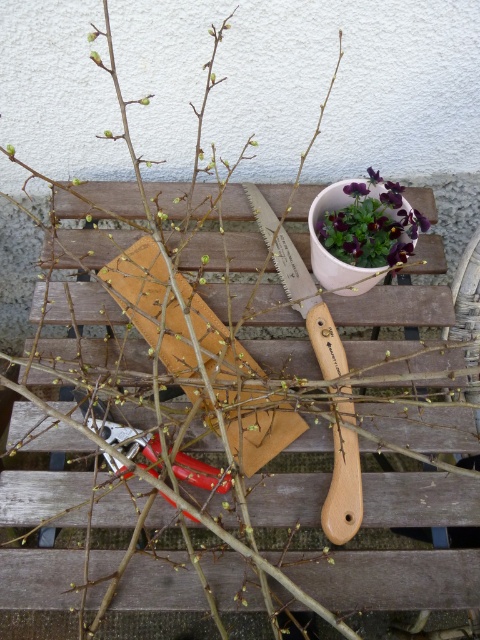
Question: Can you confirm if wooden palette at center is positioned to the right of metallic red pliers at center?

Choices:
 (A) no
 (B) yes

Answer: (B)

Question: Is wooden palette at center closer to camera compared to purple matte flower pot at upper center?

Choices:
 (A) yes
 (B) no

Answer: (A)

Question: Which of these objects is positioned farthest from the wooden palette at center?

Choices:
 (A) purple matte flower pot at upper center
 (B) metallic red pliers at center

Answer: (B)

Question: Which point is closer to the camera?

Choices:
 (A) wooden palette at center
 (B) purple matte flower pot at upper center
 (C) metallic red pliers at center

Answer: (C)

Question: Is purple matte flower pot at upper center thinner than metallic red pliers at center?

Choices:
 (A) no
 (B) yes

Answer: (B)

Question: Which point is farther to the camera?

Choices:
 (A) purple matte flower pot at upper center
 (B) metallic red pliers at center
 (C) wooden palette at center

Answer: (A)